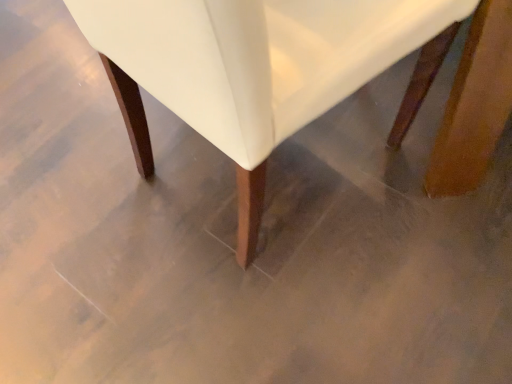
The height and width of the screenshot is (384, 512). In order to click on blank area beneath matte white chair at center (from a real-world perspective) in this screenshot , I will do `click(266, 177)`.